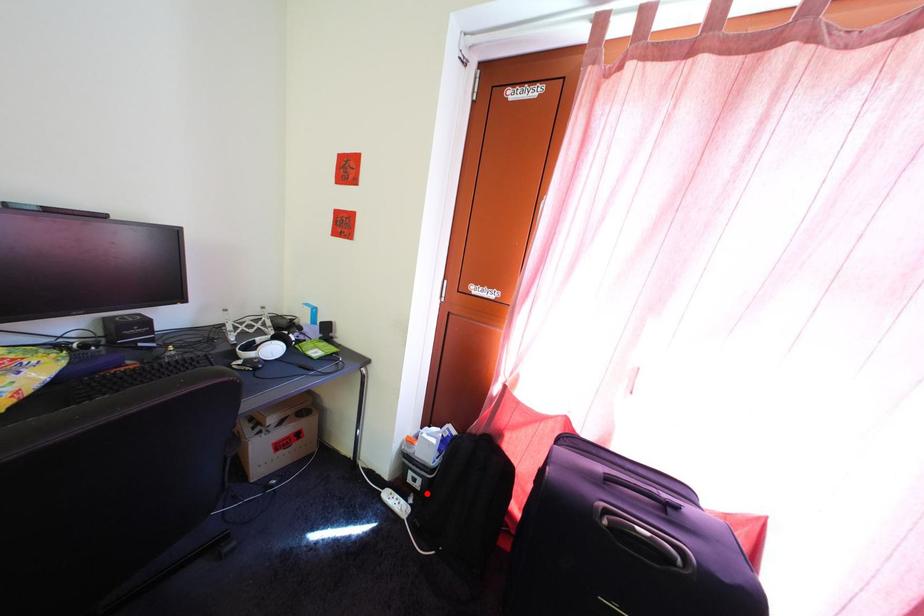
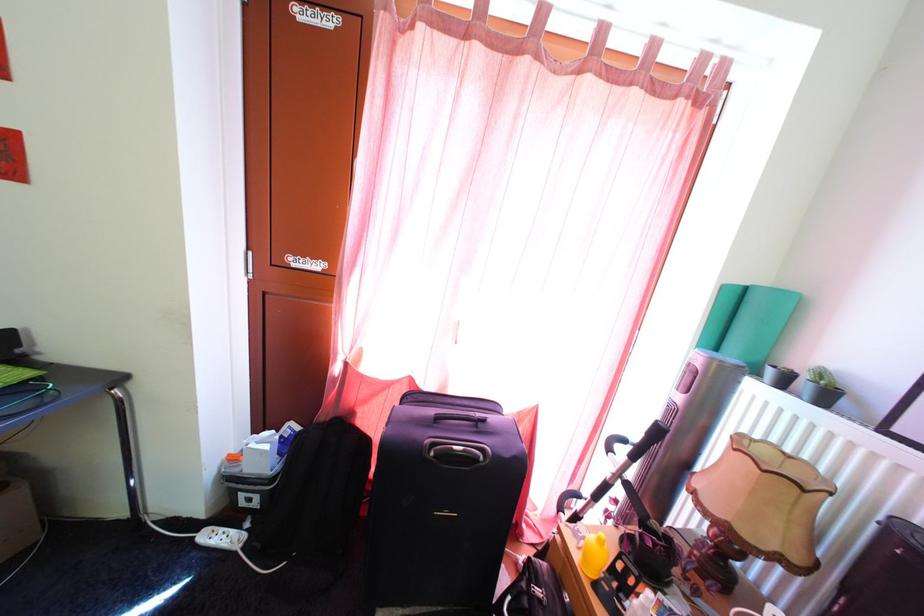
Locate, in the second image, the point that corresponds to the highlighted location in the first image.

(264, 512)